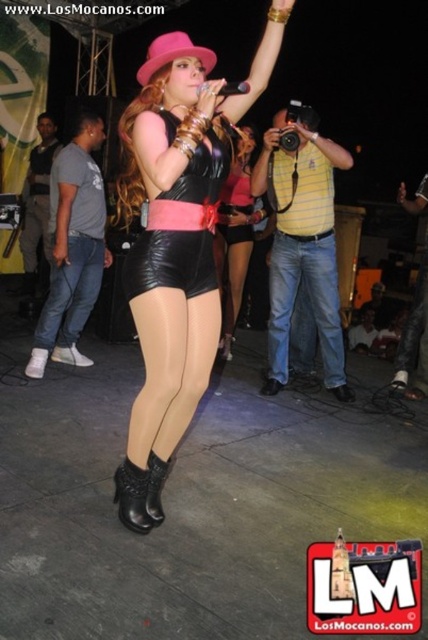
You are at the live music event and want to move from the point at coordinate (183, 202) to the point at coordinate (142, 518). Which direction should you move to get closer to your destination?

To move from point (183, 202) to point (142, 518), you should move towards the right and slightly downward since point (142, 518) is located to the right and slightly below point (183, 202).

You are standing at the live music event and want to take a photo of the performer. The camera you have can focus on objects up to 2 meters away. Is the matte black leather shorts at center within the camera focus range?

The matte black leather shorts at center is 1.93 meters away from the viewer, which is within the camera focus range of up to 2 meters. Therefore, the camera can focus on the matte black leather shorts at center.